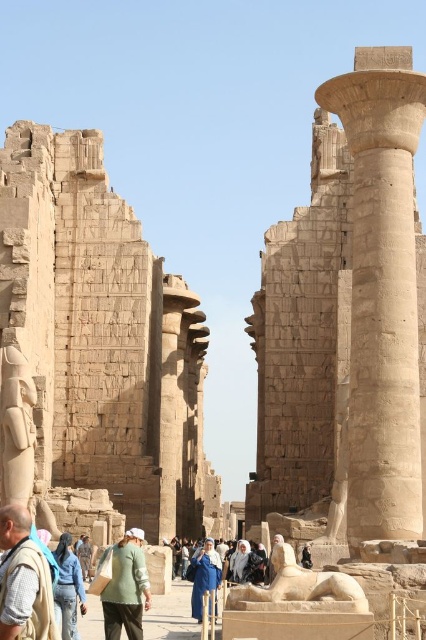
Is polished stone statue at left below blue fabric headscarf at center?

Actually, polished stone statue at left is above blue fabric headscarf at center.

Does polished stone statue at left have a greater height compared to blue fabric headscarf at center?

Yes, polished stone statue at left is taller than blue fabric headscarf at center.

At what (x,y) coordinates should I click in order to perform the action: click on polished stone statue at left. Please return your answer as a coordinate pair (x, y). Looking at the image, I should click on (16, 428).

The image size is (426, 640). Find the location of `polished stone statue at left`. polished stone statue at left is located at coordinates (16, 428).

Does sandstone statue at center appear on the left side of blue fabric headscarf at center?

No, sandstone statue at center is not to the left of blue fabric headscarf at center.

Between point (316, 584) and point (196, 573), which one is positioned in front?

Point (316, 584) is more forward.

Between point (316, 582) and point (199, 604), which one is positioned in front?

Point (316, 582)

This screenshot has width=426, height=640. Find the location of `sandstone statue at center`. sandstone statue at center is located at coordinates (299, 588).

Is sandstone statue at center thinner than green cotton shirt at center?

No.

This screenshot has width=426, height=640. Find the location of `sandstone statue at center`. sandstone statue at center is located at coordinates 299,588.